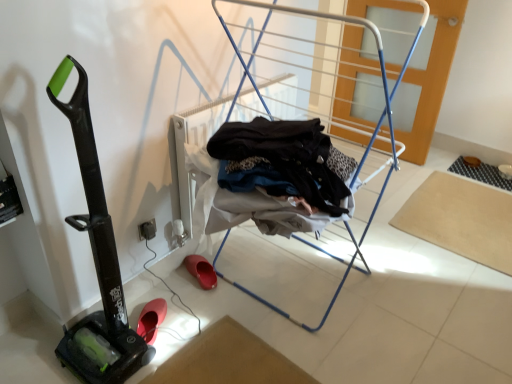
You are a GUI agent. You are given a task and a screenshot of the screen. Output one action in this format:
    pyautogui.click(x=<x>, y=<y>)
    Task: Click on the free area in between rubber/soft sole shoe at lower left, marked as the 1th footwear in a front-to-back arrangement, and beige fabric yoga mat at lower right
    
    Given the screenshot: What is the action you would take?
    pyautogui.click(x=336, y=262)